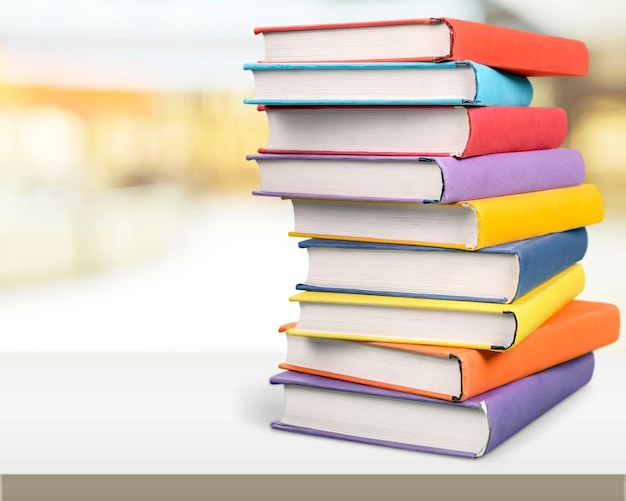
Identify the location of book. Image resolution: width=626 pixels, height=501 pixels. (469, 35), (461, 81), (461, 125), (458, 163), (468, 212), (489, 275), (480, 317), (449, 365), (441, 421).